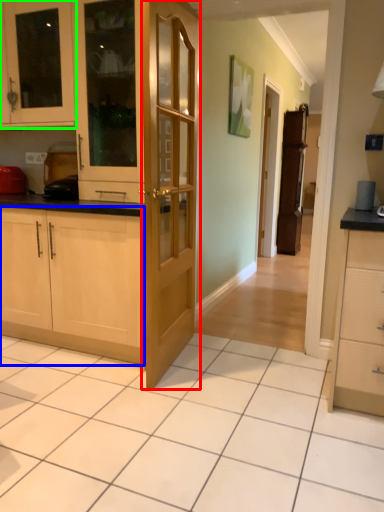
Question: Estimate the real-world distances between objects in this image. Which object is closer to door (highlighted by a red box), cabinetry (highlighted by a blue box) or cabinetry (highlighted by a green box)?

Choices:
 (A) cabinetry
 (B) cabinetry

Answer: (A)